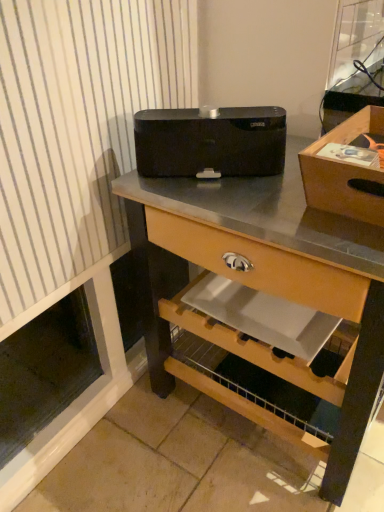
Describe the element at coordinates (343, 172) in the screenshot. I see `wooden box at upper right` at that location.

What is the approximate width of black matte speaker at center?

It is 26.98 inches.

Where is `wooden box at upper right`? The width and height of the screenshot is (384, 512). wooden box at upper right is located at coordinates coord(343,172).

From the image's perspective, is black matte speaker at center under wooden box at upper right?

Actually, black matte speaker at center appears above wooden box at upper right in the image.

Is black matte speaker at center oriented towards wooden box at upper right?

No, black matte speaker at center does not turn towards wooden box at upper right.

How different are the orientations of black matte speaker at center and wooden box at upper right in degrees?

black matte speaker at center and wooden box at upper right are facing 38.5 degrees away from each other.

Identify the location of appliance located above the wooden box at upper right (from the image's perspective). The image size is (384, 512). (210, 142).

From the picture: Which of these two, black matte speaker at center or black matte speaker at center, stands taller?

black matte speaker at center.

Considering the points (177, 141) and (257, 230), which point is behind, point (177, 141) or point (257, 230)?

The point (177, 141) is more distant.

What's the angular difference between black matte speaker at center and black matte speaker at center's facing directions?

They differ by 54.1 degrees in their facing directions.

From a real-world perspective, which object rests below the other?

black matte speaker at center is physically lower.

Considering the sizes of wooden box at upper right and black matte speaker at center in the image, is wooden box at upper right bigger or smaller than black matte speaker at center?

Clearly, wooden box at upper right is smaller in size than black matte speaker at center.

Can black matte speaker at center be found inside wooden box at upper right?

No, black matte speaker at center is not inside wooden box at upper right.

Does point (353, 138) lie behind point (342, 422)?

No.

Between black matte speaker at center and black matte speaker at center, which one appears on the right side from the viewer's perspective?

Positioned to the right is black matte speaker at center.

Which object is wider, black matte speaker at center or black matte speaker at center?

black matte speaker at center is wider.

Does black matte speaker at center have a smaller size compared to black matte speaker at center?

No.

Which of these two, wooden box at upper right or black matte speaker at center, is smaller?

Smaller between the two is black matte speaker at center.

Which point is more distant from viewer, (367, 127) or (279, 119)?

The point (367, 127) is farther from the camera.

Considering the sizes of wooden box at upper right and black matte speaker at center in the image, is wooden box at upper right wider or thinner than black matte speaker at center?

wooden box at upper right is wider than black matte speaker at center.

Based on the photo, from a real-world perspective, between black matte speaker at center and wooden box at upper right, who is vertically higher?

wooden box at upper right.

Is black matte speaker at center next to wooden box at upper right and touching it?

No, black matte speaker at center is not next to wooden box at upper right.

Do you think black matte speaker at center is within wooden box at upper right, or outside of it?

black matte speaker at center is located beyond the bounds of wooden box at upper right.

Does point (185, 239) lie in front of point (329, 186)?

No.

Locate an element on the screen. This screenshot has width=384, height=512. appliance located underneath the wooden box at upper right (from a real-world perspective) is located at coordinates (210, 142).

Image resolution: width=384 pixels, height=512 pixels. I want to click on desk located on the right of black matte speaker at center, so click(280, 266).

Estimate the real-world distances between objects in this image. Which object is further from black matte speaker at center, wooden box at upper right or black matte speaker at center?

wooden box at upper right lies further to black matte speaker at center than the other object.

In the scene shown: From the image, which object appears to be nearer to black matte speaker at center, black matte speaker at center or wooden box at upper right?

The object closer to black matte speaker at center is black matte speaker at center.

Based on their spatial positions, is black matte speaker at center or black matte speaker at center further from wooden box at upper right?

black matte speaker at center.

Estimate the real-world distances between objects in this image. Which object is closer to black matte speaker at center, wooden box at upper right or black matte speaker at center?

black matte speaker at center lies closer to black matte speaker at center than the other object.

When comparing their distances from wooden box at upper right, does black matte speaker at center or black matte speaker at center seem closer?

Based on the image, black matte speaker at center appears to be nearer to wooden box at upper right.

In the scene shown: From the image, which object appears to be nearer to black matte speaker at center, black matte speaker at center or wooden box at upper right?

Among the two, black matte speaker at center is located nearer to black matte speaker at center.

Where is `box that lies between black matte speaker at center and black matte speaker at center from top to bottom`? The height and width of the screenshot is (512, 384). box that lies between black matte speaker at center and black matte speaker at center from top to bottom is located at coordinates (343, 172).